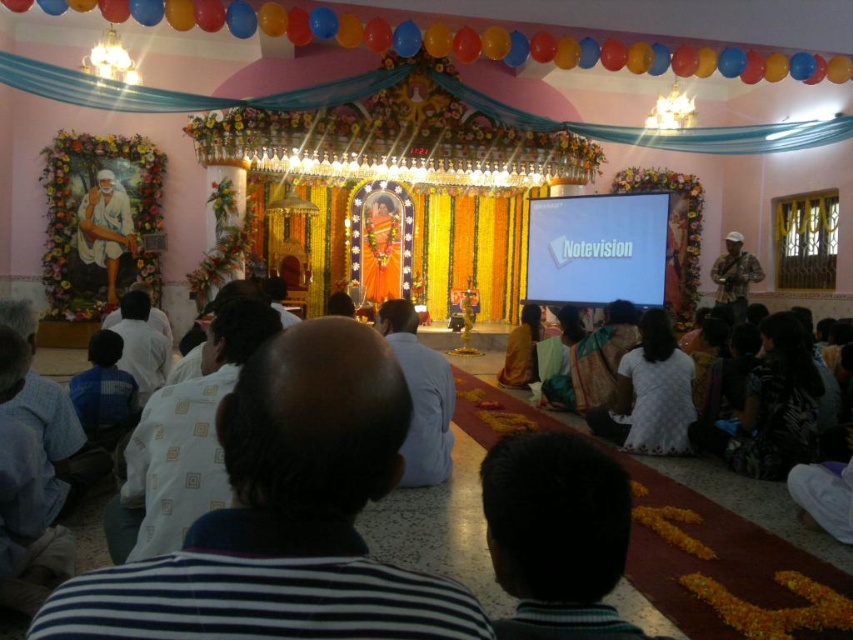
Does white clothed figure at left appear under camouflage fabric shirt at right?

No, white clothed figure at left is not below camouflage fabric shirt at right.

Which is above, white clothed figure at left or camouflage fabric shirt at right?

white clothed figure at left is higher up.

Is point (112, 204) less distant than point (747, 252)?

That is True.

At what (x,y) coordinates should I click in order to perform the action: click on white clothed figure at left. Please return your answer as a coordinate pair (x, y). This screenshot has height=640, width=853. Looking at the image, I should click on (105, 228).